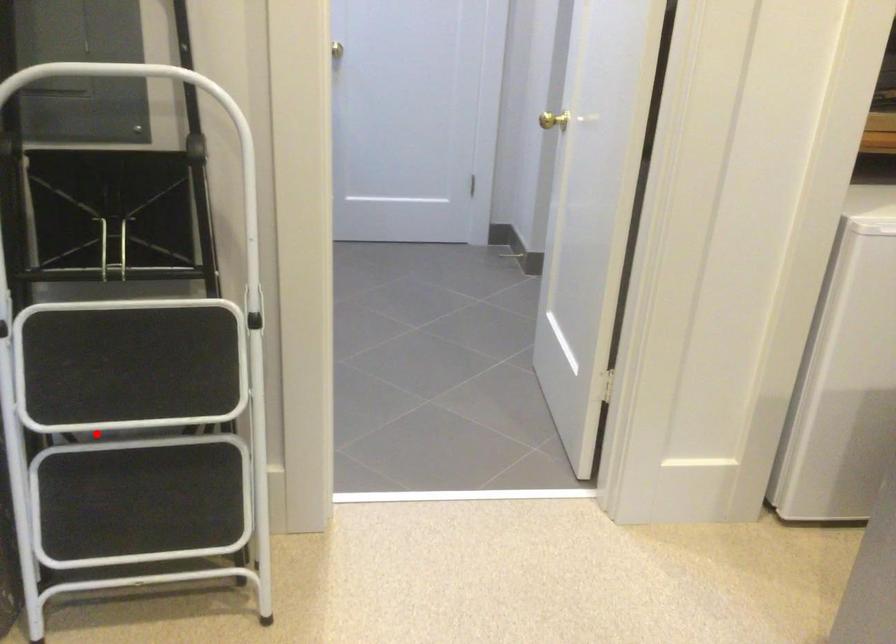
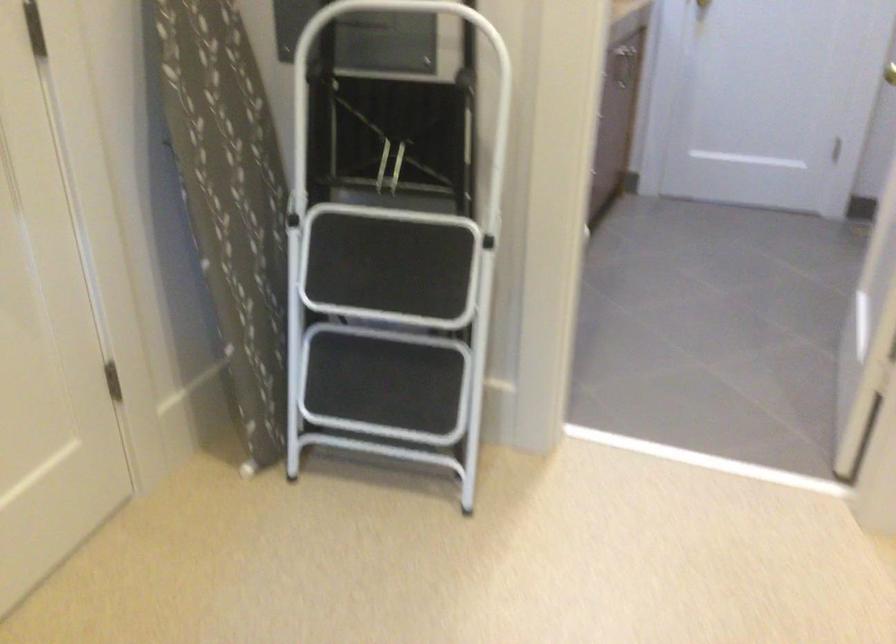
Question: A red point is marked in image1. In image2, is the corresponding 3D point closer to the camera or farther? Reply with the corresponding letter.

Choices:
 (A) The corresponding 3D point is closer.
 (B) The corresponding 3D point is farther.

Answer: (B)